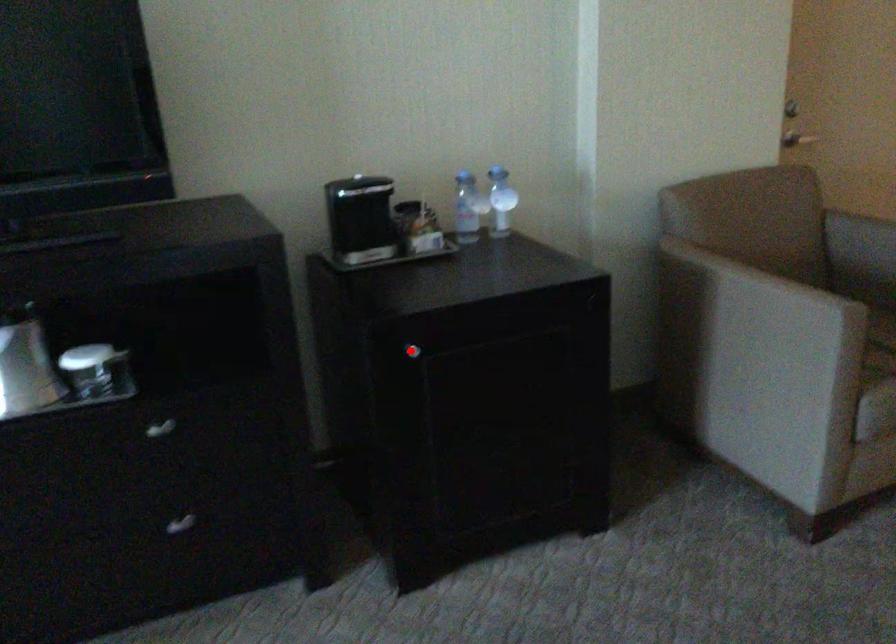
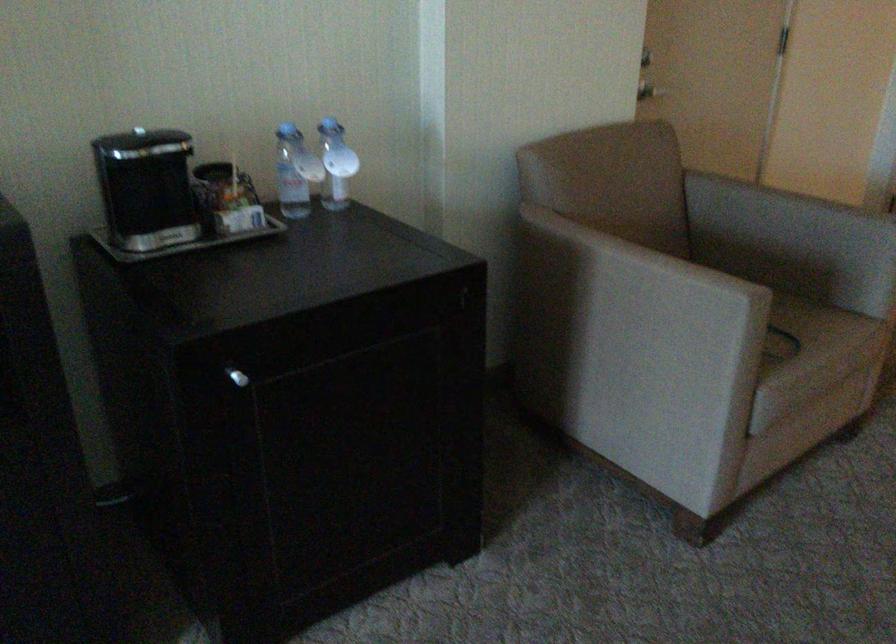
Question: I am providing you with two images of the same scene from different viewpoints. Given a red point in image1, look at the same physical point in image2. Is it:

Choices:
 (A) Closer to the viewpoint
 (B) Farther from the viewpoint

Answer: (A)